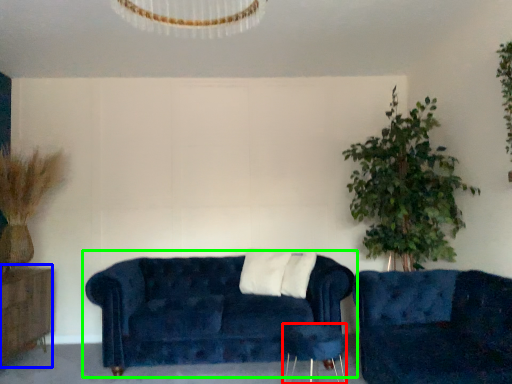
Question: Which object is positioned closest to side table (highlighted by a red box)? Select from dresser (highlighted by a blue box) and studio couch (highlighted by a green box).

Choices:
 (A) dresser
 (B) studio couch

Answer: (B)